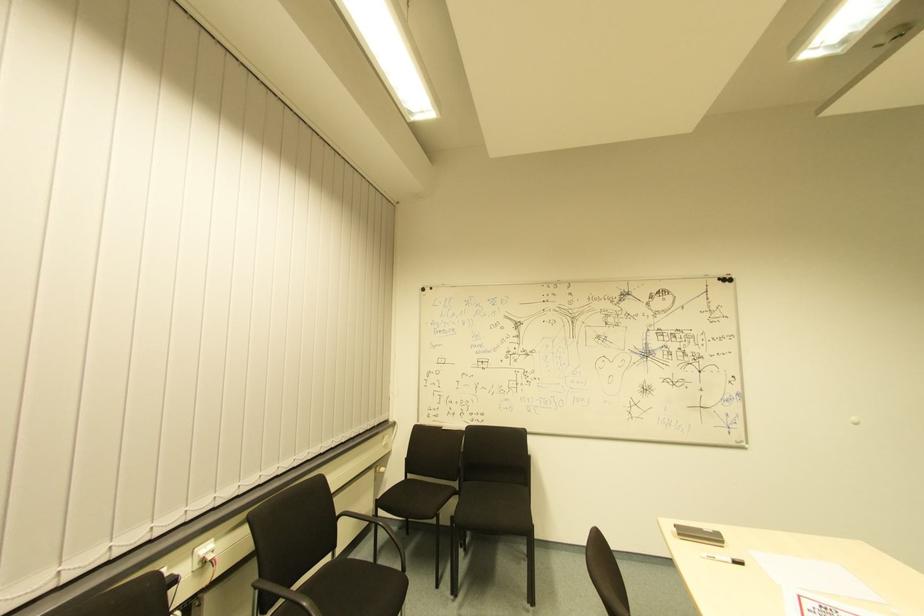
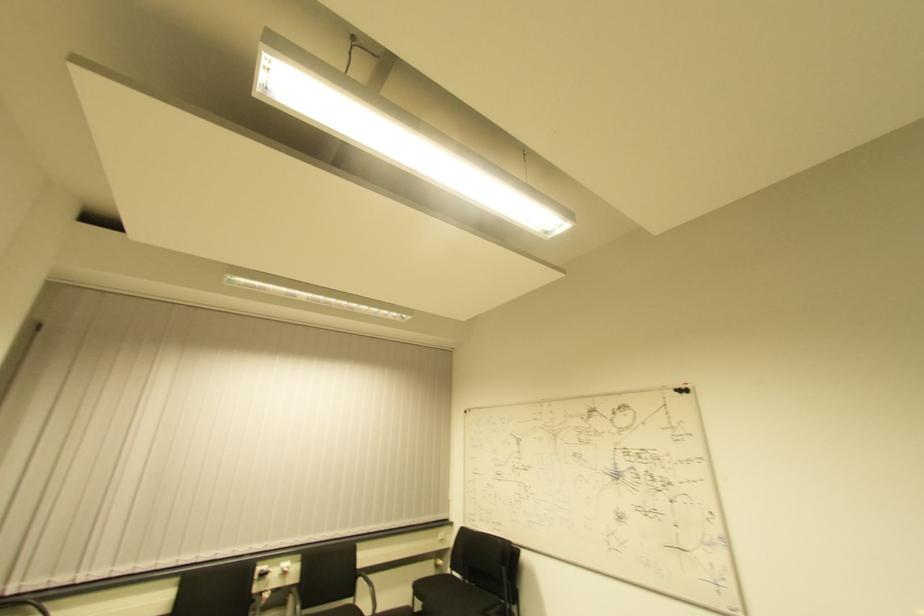
Find the pixel in the second image that matches point 393,427 in the first image.

(450, 527)